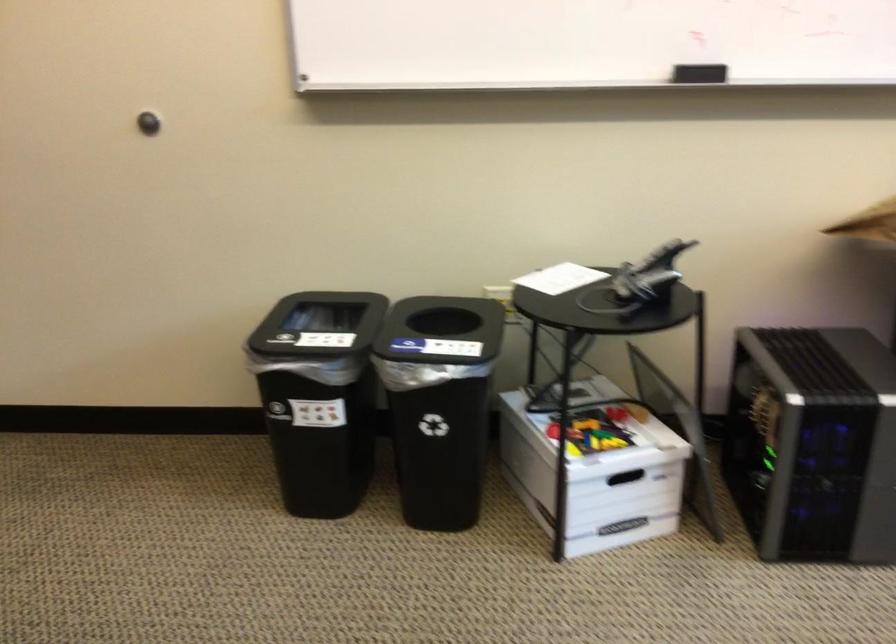
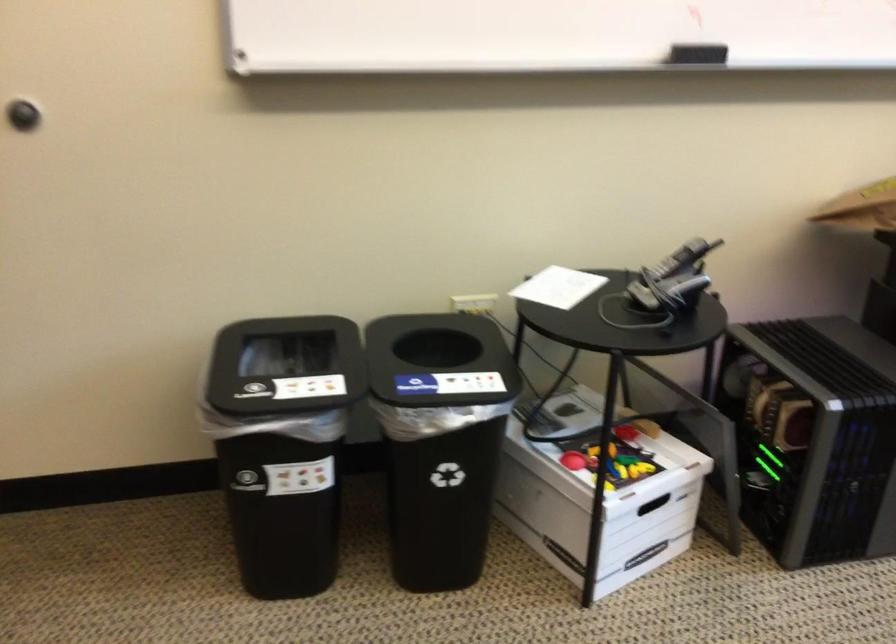
Question: The images are taken continuously from a first-person perspective. In which direction is your viewpoint rotating?

Choices:
 (A) Left
 (B) Right
 (C) Up
 (D) Down

Answer: (B)